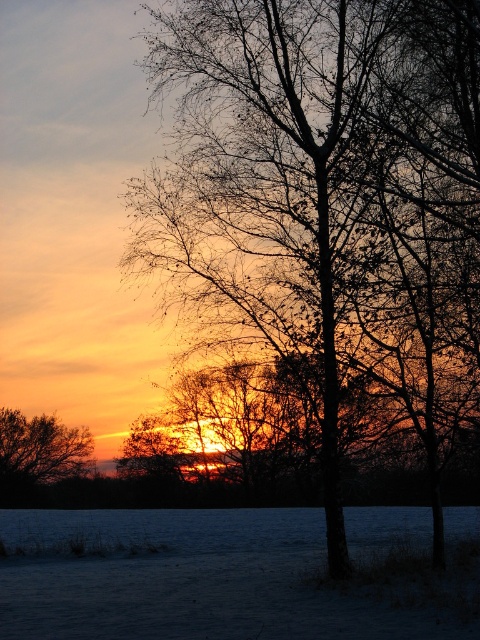
Between brown/dry wood tree at center and brown matte tree at left, which one appears on the left side from the viewer's perspective?

brown matte tree at left

Between brown/dry wood tree at center and brown matte tree at left, which one has less height?

With less height is brown matte tree at left.

Identify the location of brown/dry wood tree at center. This screenshot has width=480, height=640. tap(316, 179).